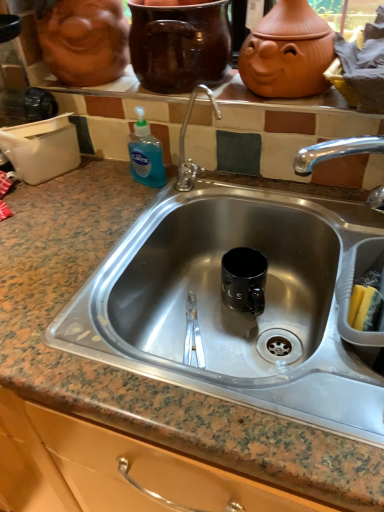
Question: Is marble granite sink at center touching matte ceramic pots at upper center?

Choices:
 (A) yes
 (B) no

Answer: (B)

Question: Is marble granite sink at center facing away from matte ceramic pots at upper center?

Choices:
 (A) yes
 (B) no

Answer: (B)

Question: From the image's perspective, is marble granite sink at center below matte ceramic pots at upper center?

Choices:
 (A) no
 (B) yes

Answer: (B)

Question: Considering the relative positions of marble granite sink at center and matte ceramic pots at upper center in the image provided, is marble granite sink at center in front of matte ceramic pots at upper center?

Choices:
 (A) yes
 (B) no

Answer: (A)

Question: Can you confirm if marble granite sink at center is bigger than matte ceramic pots at upper center?

Choices:
 (A) no
 (B) yes

Answer: (B)

Question: From a real-world perspective, does marble granite sink at center stand above matte ceramic pots at upper center?

Choices:
 (A) yes
 (B) no

Answer: (B)

Question: Could you tell me if matte ceramic face at upper left is facing glossy ceramic mug at upper center?

Choices:
 (A) yes
 (B) no

Answer: (B)

Question: From the image's perspective, is matte ceramic face at upper left below glossy ceramic mug at upper center?

Choices:
 (A) yes
 (B) no

Answer: (B)

Question: Does matte ceramic face at upper left have a larger size compared to glossy ceramic mug at upper center?

Choices:
 (A) yes
 (B) no

Answer: (A)

Question: Is matte ceramic face at upper left with glossy ceramic mug at upper center?

Choices:
 (A) no
 (B) yes

Answer: (A)

Question: From a real-world perspective, is matte ceramic face at upper left physically above glossy ceramic mug at upper center?

Choices:
 (A) yes
 (B) no

Answer: (A)

Question: Does matte ceramic face at upper left have a lesser width compared to glossy ceramic mug at upper center?

Choices:
 (A) no
 (B) yes

Answer: (A)

Question: Is marble granite sink at center oriented towards matte ceramic face at upper left?

Choices:
 (A) no
 (B) yes

Answer: (A)